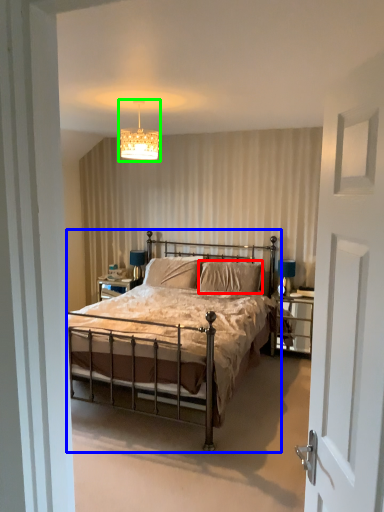
Question: Which object is the farthest from pillow (highlighted by a red box)? Choose among these: bed (highlighted by a blue box) or light fixture (highlighted by a green box).

Choices:
 (A) bed
 (B) light fixture

Answer: (B)